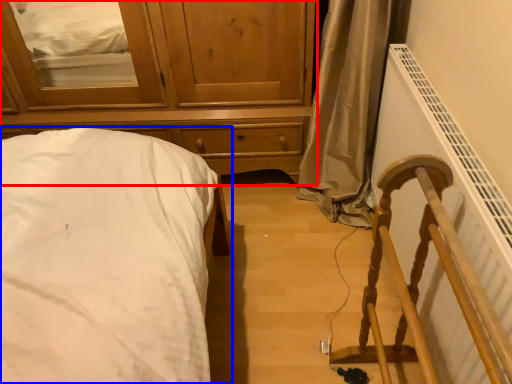
Question: Which object is further to the camera taking this photo, chest of drawers (highlighted by a red box) or bed (highlighted by a blue box)?

Choices:
 (A) chest of drawers
 (B) bed

Answer: (A)